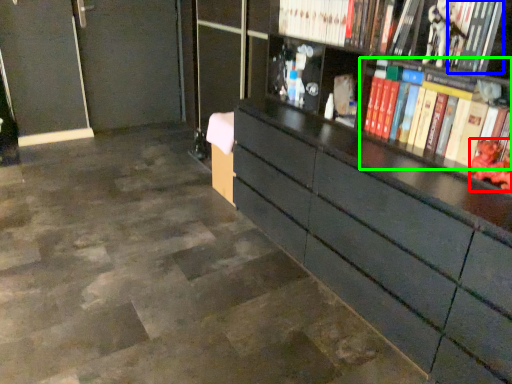
Question: Which is nearer to the toy (highlighted by a red box)? book (highlighted by a blue box) or book (highlighted by a green box).

Choices:
 (A) book
 (B) book

Answer: (B)